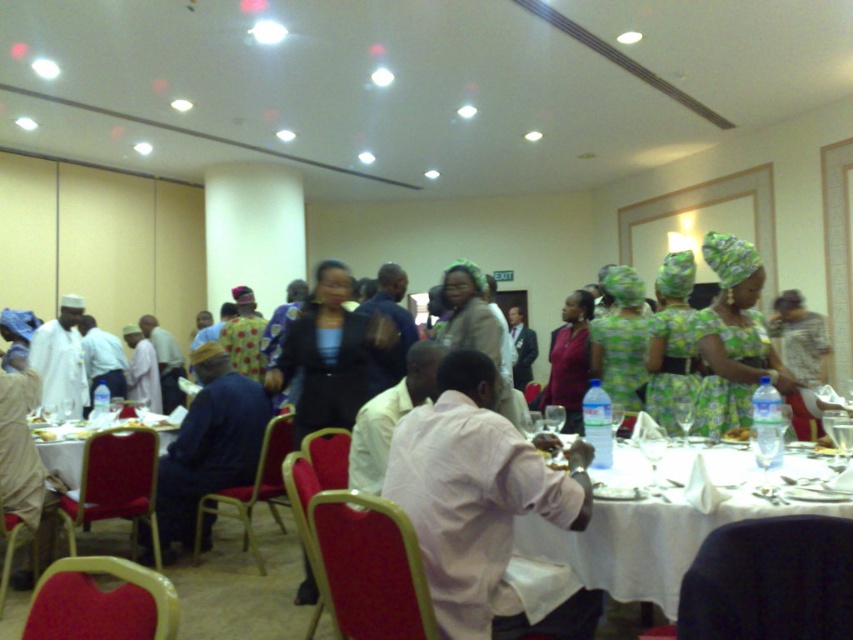
You are a photographer at the event and need to capture a photo of the green printed dress at center without the white cloth at center appearing in the foreground. Is this possible given their positions?

The white cloth at center is located below the green printed dress at center, so if you position the camera to focus on the dress while angling slightly upwards, the cloth will not be in the foreground.

You are standing at the entrance of the banquet hall and see two points marked in the image. Which point, point (722, 428) or point (782, 358), is closer to you?

Point (722, 428) is closer to the camera than point (782, 358), so the point closer to you is point (722, 428).